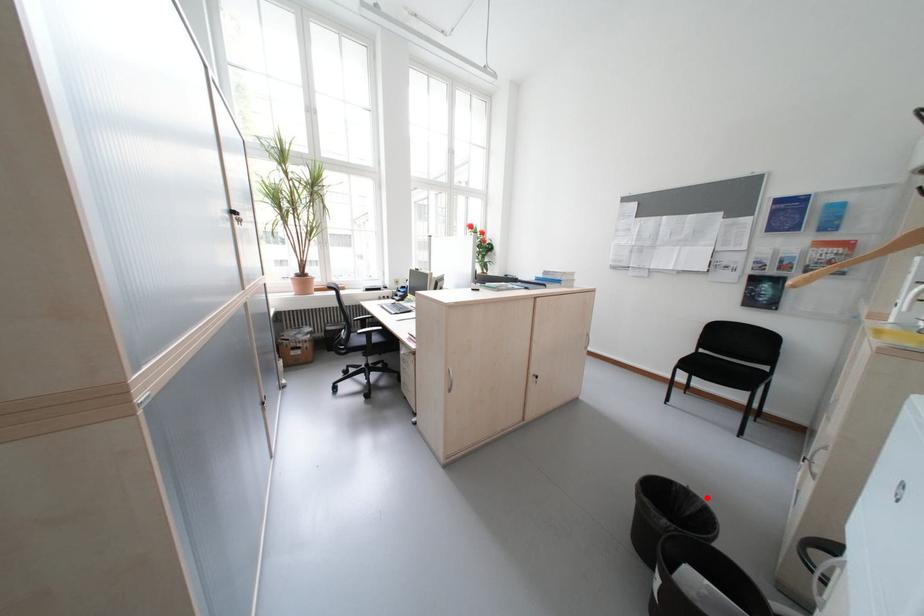
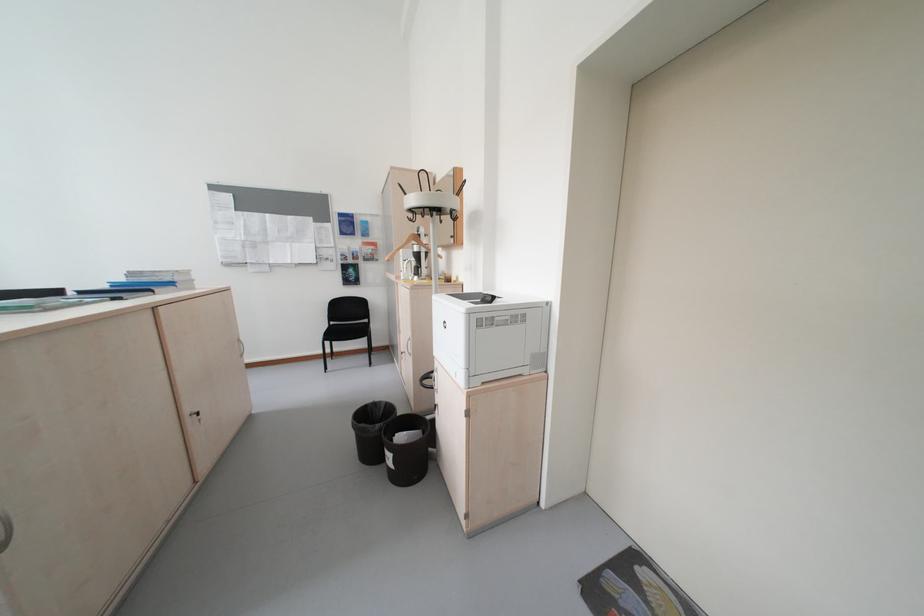
Find the pixel in the second image that matches the highlighted location in the first image.

(391, 403)